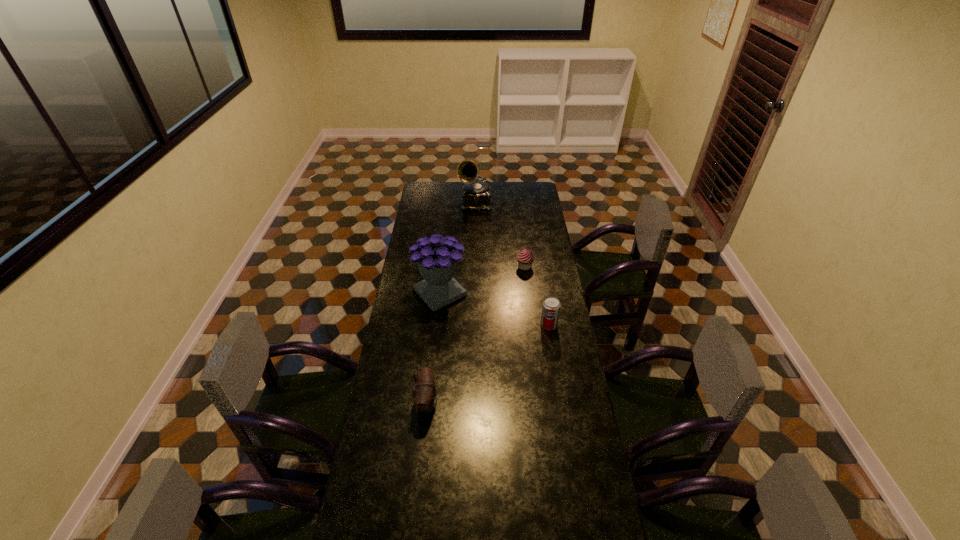
Where is `free space between the farthest object and the cupcake`? free space between the farthest object and the cupcake is located at coordinates [x=500, y=235].

Find the location of a particular element. This screenshot has width=960, height=540. free space between the pouch and the third nearest object is located at coordinates (433, 348).

Find the location of `free area in between the fourth farthest object and the third farthest object`. free area in between the fourth farthest object and the third farthest object is located at coordinates (494, 309).

The height and width of the screenshot is (540, 960). Find the location of `empty space that is in between the nearest object and the shortest object`. empty space that is in between the nearest object and the shortest object is located at coordinates (476, 335).

Locate which object is the second closest to the nearest object. Please provide its 2D coordinates. Your answer should be formatted as a tuple, i.e. [(x, y)], where the tuple contains the x and y coordinates of a point satisfying the conditions above.

[(551, 306)]

Locate an element on the screen. object that is the fourth closest one to the bouquet is located at coordinates (476, 195).

Where is `vacant space that satisfies the following two spatial constraints: 1. on the front side of the bouquet; 2. with the flap open on the nearest object`? This screenshot has height=540, width=960. vacant space that satisfies the following two spatial constraints: 1. on the front side of the bouquet; 2. with the flap open on the nearest object is located at coordinates (429, 403).

The image size is (960, 540). I want to click on vacant space that satisfies the following two spatial constraints: 1. on the front side of the soda; 2. on the right side of the shortest object, so click(x=532, y=325).